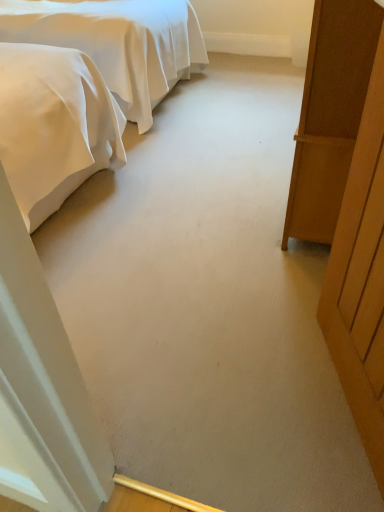
This screenshot has height=512, width=384. What are the coordinates of `wooden door at right` in the screenshot? It's located at coord(361,278).

Find the location of a particular element. The height and width of the screenshot is (512, 384). satin white bed at upper left is located at coordinates (117, 42).

Describe the element at coordinates (330, 114) in the screenshot. I see `wooden wardrobe at right` at that location.

Where is `wooden door at right`? wooden door at right is located at coordinates pyautogui.click(x=361, y=278).

Is wooden door at right wider than wooden wardrobe at right?

No, wooden door at right is not wider than wooden wardrobe at right.

Can you confirm if wooden door at right is shorter than wooden wardrobe at right?

No.

From the image's perspective, which is below, wooden door at right or wooden wardrobe at right?

wooden door at right appears lower in the image.

Based on the photo, looking at the image, does wooden door at right seem bigger or smaller compared to wooden wardrobe at right?

Considering their sizes, wooden door at right takes up less space than wooden wardrobe at right.

In the scene shown: Is the position of wooden door at right less distant than that of satin white bed at upper left?

Yes.

Which is less distant, [381,303] or [165,35]?

Point [381,303]

Does wooden door at right appear on the right side of satin white bed at upper left?

Yes.

Which is less distant, (142,49) or (367,259)?

Clearly, point (142,49) is more distant from the camera than point (367,259).

From a real-world perspective, between satin white bed at upper left and wooden door at right, who is vertically lower?

From a 3D spatial view, satin white bed at upper left is below.

Considering the sizes of satin white bed at upper left and wooden door at right in the image, is satin white bed at upper left taller or shorter than wooden door at right?

In the image, satin white bed at upper left appears to be shorter than wooden door at right.

Based on the photo, relative to wooden door at right, is satin white bed at upper left in front or behind?

satin white bed at upper left is behind wooden door at right.

Relative to wooden door at right, is wooden wardrobe at right in front or behind?

wooden wardrobe at right is positioned farther from the viewer than wooden door at right.

Locate an element on the screen. furniture below the wooden door at right (from a real-world perspective) is located at coordinates (330, 114).

Which is more to the left, wooden wardrobe at right or wooden door at right?

wooden door at right.

How far apart are wooden wardrobe at right and wooden door at right?

wooden wardrobe at right is 16.96 inches away from wooden door at right.

At what (x,y) coordinates should I click in order to perform the action: click on bed that appears below the wooden wardrobe at right (from a real-world perspective). Please return your answer as a coordinate pair (x, y). The height and width of the screenshot is (512, 384). Looking at the image, I should click on (117, 42).

From a real-world perspective, is satin white bed at upper left located beneath wooden wardrobe at right?

Yes.

Does satin white bed at upper left come behind wooden wardrobe at right?

Yes, satin white bed at upper left is behind wooden wardrobe at right.

Does satin white bed at upper left have a greater height compared to wooden wardrobe at right?

No.

Does wooden wardrobe at right turn towards satin white bed at upper left?

Yes, wooden wardrobe at right is oriented towards satin white bed at upper left.

Does wooden wardrobe at right lie in front of satin white bed at upper left?

Yes, wooden wardrobe at right is closer to the camera.

From a real-world perspective, which is physically above, wooden wardrobe at right or satin white bed at upper left?

wooden wardrobe at right is physically above.

Image resolution: width=384 pixels, height=512 pixels. What are the coordinates of `furniture behind the wooden door at right` in the screenshot? It's located at (330, 114).

Locate an element on the screen. The image size is (384, 512). door on the right side of satin white bed at upper left is located at coordinates (361, 278).

When comparing their distances from wooden wardrobe at right, does wooden door at right or satin white bed at upper left seem closer?

Among the two, wooden door at right is located nearer to wooden wardrobe at right.

Estimate the real-world distances between objects in this image. Which object is further from wooden wardrobe at right, satin white bed at upper left or wooden door at right?

The object further to wooden wardrobe at right is satin white bed at upper left.

Looking at this image, based on their spatial positions, is wooden wardrobe at right or wooden door at right closer to satin white bed at upper left?

Among the two, wooden wardrobe at right is located nearer to satin white bed at upper left.

Which object lies nearer to the anchor point satin white bed at upper left, wooden door at right or wooden wardrobe at right?

wooden wardrobe at right lies closer to satin white bed at upper left than the other object.

Based on their spatial positions, is wooden wardrobe at right or satin white bed at upper left further from wooden door at right?

satin white bed at upper left is further to wooden door at right.

Considering their positions, is satin white bed at upper left positioned closer to wooden door at right than wooden wardrobe at right?

wooden wardrobe at right is positioned closer to the anchor wooden door at right.

This screenshot has width=384, height=512. I want to click on door located between satin white bed at upper left and wooden wardrobe at right in the left-right direction, so click(361, 278).